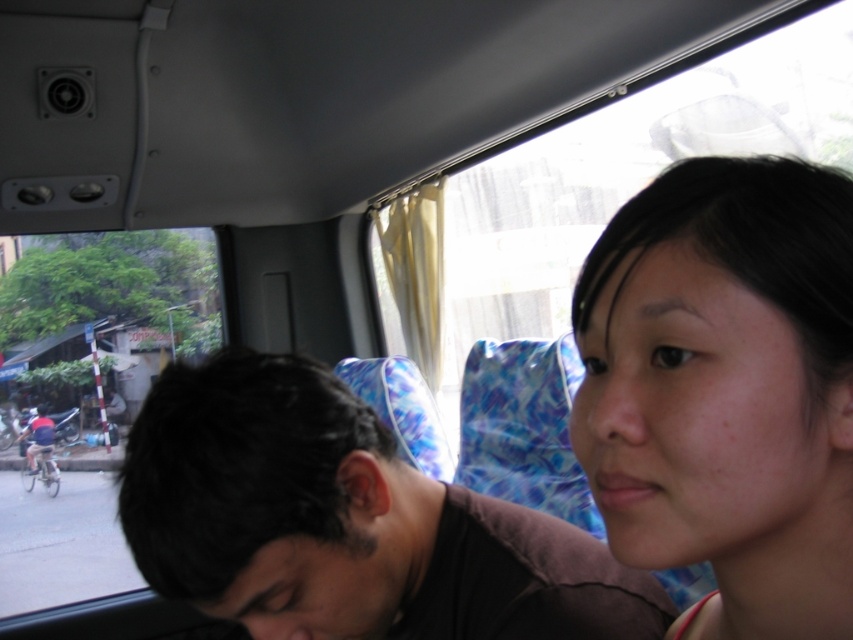
Is point (724, 554) closer to camera compared to point (228, 392)?

Yes, it is.

Can you confirm if smooth skin face at center is positioned to the right of dark brown hair at center?

Yes, smooth skin face at center is to the right of dark brown hair at center.

Locate an element on the screen. smooth skin face at center is located at coordinates (726, 388).

Locate an element on the screen. smooth skin face at center is located at coordinates (726, 388).

Which is behind, point (614, 588) or point (21, 582)?

The point (21, 582) is more distant.

Describe the element at coordinates (345, 522) in the screenshot. I see `dark brown hair at center` at that location.

Is point (170, 481) positioned behind point (21, 554)?

No.

The height and width of the screenshot is (640, 853). What are the coordinates of `dark brown hair at center` in the screenshot? It's located at (345, 522).

Which is above, smooth skin face at center or transparent glass window at left?

smooth skin face at center is higher up.

Measure the distance between point [660,372] and camera.

They are 35.33 centimeters apart.

Where is `smooth skin face at center`? Image resolution: width=853 pixels, height=640 pixels. smooth skin face at center is located at coordinates (726, 388).